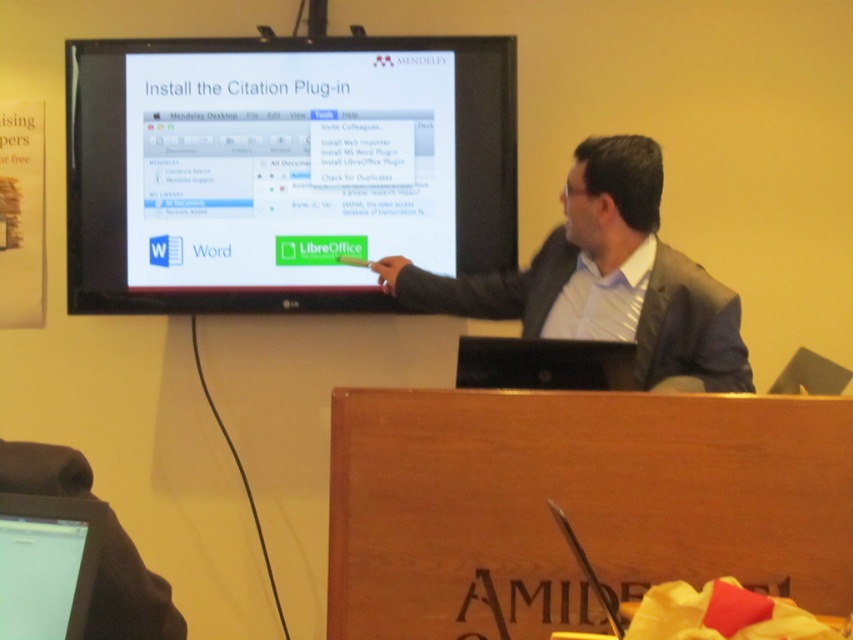
You are setting up a presentation and need to place a laptop next to a monitor. The laptop must be positioned so that its screen is visible to the audience. Based on the scene description, can you determine if the black plastic laptop at center has enough space to the right of the matte black monitor at upper center to be placed there?

The matte black monitor at upper center might be wider than the black plastic laptop at center, so there is a possibility that placing the laptop to the right of the matte black monitor at upper center would leave enough space for visibility. However, since the exact width difference isn not specified, it is recommended to check the physical dimensions before final placement.